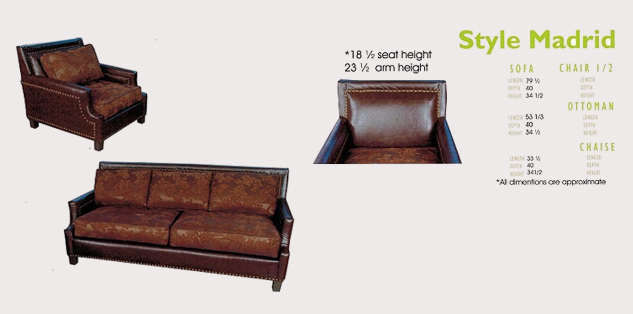
Identify the location of right chair arm. (330, 149), (63, 91).